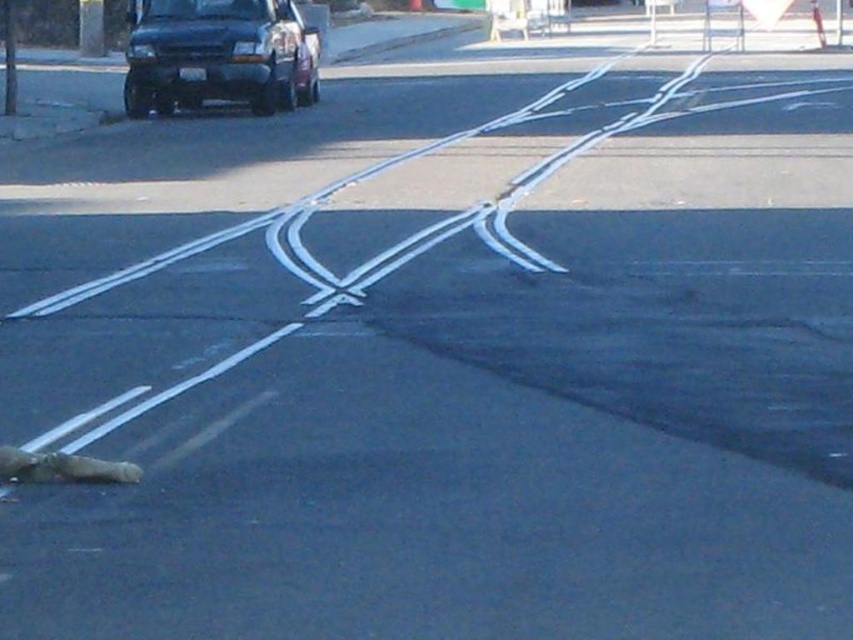
You are a pedestrian standing at the center of the road where the X is painted. You see the black matte van at upper left and the brown fur animal at lower left. Which object is closer to you?

The brown fur animal at lower left is closer to you because it is behind the black matte van at upper left, meaning the van is between you and the animal.

You are standing at the point closest to the vehicle in the image. Which of the two points, point (267, 106) or point (24, 452), is farther away from you?

Point (267, 106) is behind point (24, 452), so it is farther away from you.

Looking at this image, you are standing at the center of the road where the white lines form an X. You want to walk to the black matte van at upper left. In which direction should you walk?

Since the black matte van at upper left is located at point [218,54], you should walk towards the upper left direction to reach it.